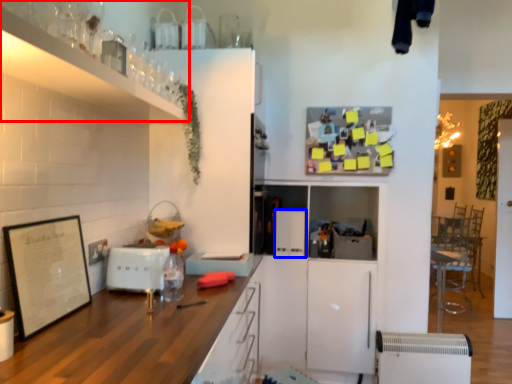
Question: Which of the following is the closest to the observer, cabinetry (highlighted by a red box) or appliance (highlighted by a blue box)?

Choices:
 (A) cabinetry
 (B) appliance

Answer: (A)